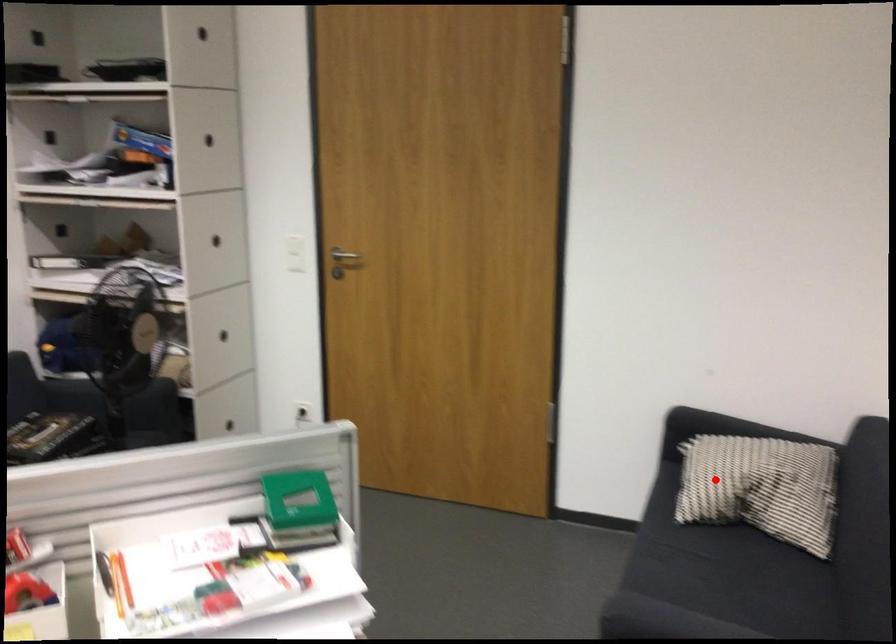
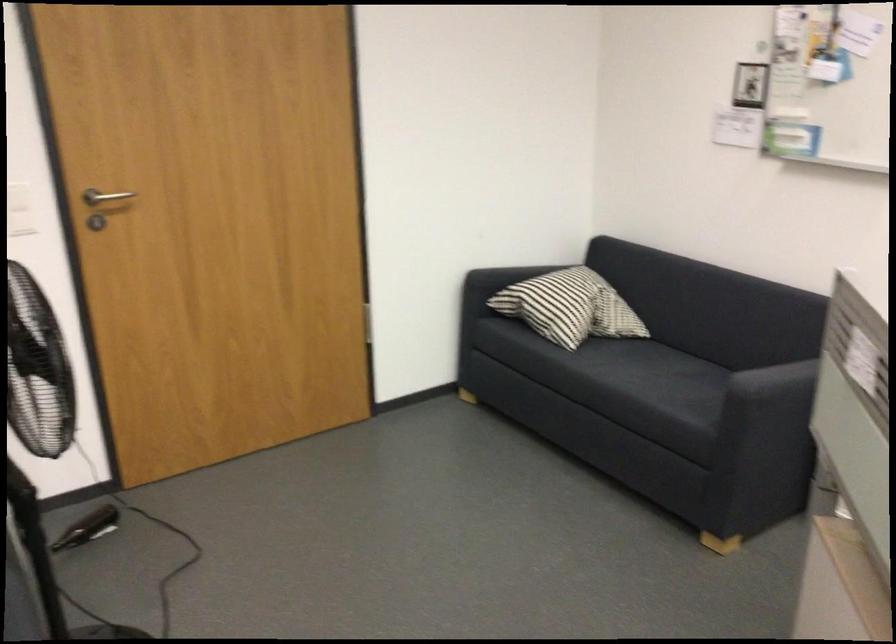
Question: I am providing you with two images of the same scene from different viewpoints. Image1 has a red point marked. In image2, the corresponding 3D location appears at what relative position? Reply with the corresponding letter.

Choices:
 (A) Closer
 (B) Farther

Answer: (B)